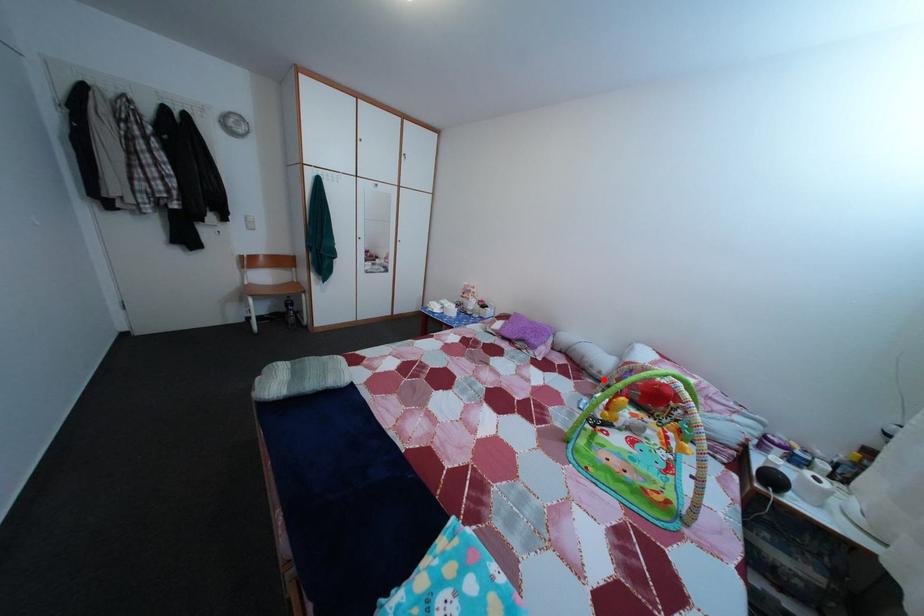
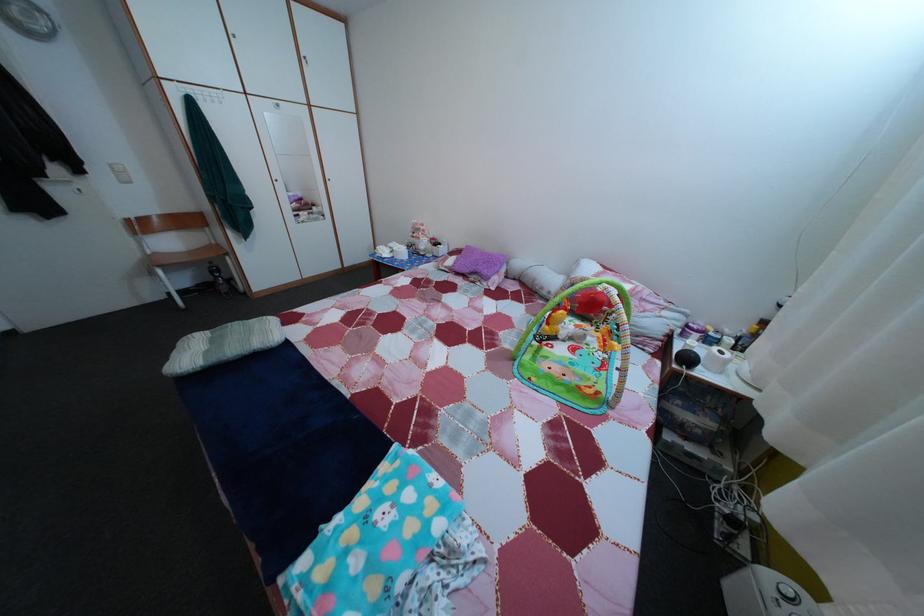
Where in the second image is the point corresponding to the highlighted location from the first image?

(553, 301)